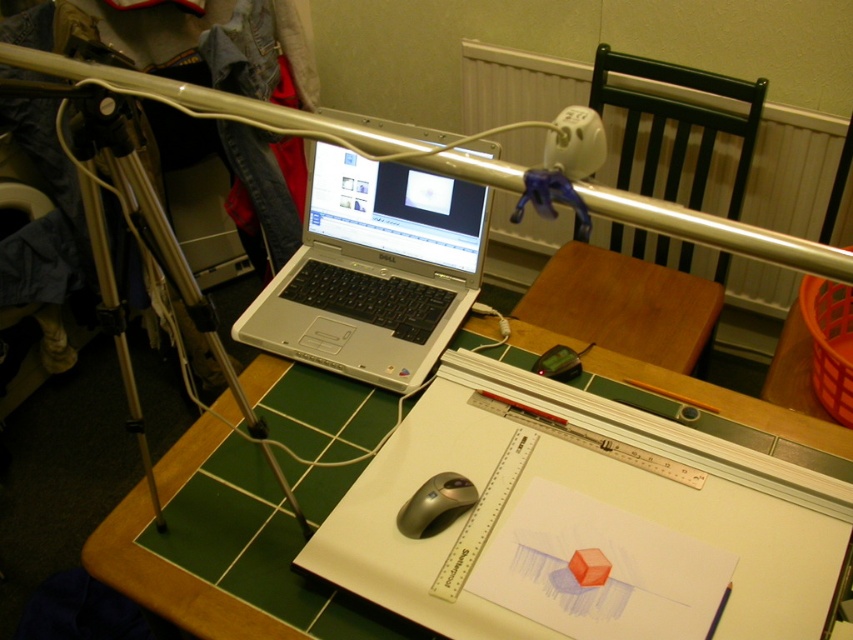
Question: Can you confirm if green tile table at center is positioned below silver metallic rail at upper center?

Choices:
 (A) yes
 (B) no

Answer: (A)

Question: Is silver metallic laptop at center thinner than green tile table at center?

Choices:
 (A) yes
 (B) no

Answer: (B)

Question: Considering the real-world distances, which object is farthest from the silver metallic laptop at center?

Choices:
 (A) silver metallic mouse at center
 (B) green tile table at center
 (C) silver metallic rail at upper center

Answer: (C)

Question: Which of the following is the farthest from the observer?

Choices:
 (A) silver metallic mouse at center
 (B) silver metallic rail at upper center
 (C) green tile table at center

Answer: (A)

Question: Can you confirm if silver metallic rail at upper center is positioned above silver metallic mouse at center?

Choices:
 (A) no
 (B) yes

Answer: (B)

Question: Which point is farther to the camera?

Choices:
 (A) silver metallic laptop at center
 (B) green tile table at center
 (C) silver metallic mouse at center

Answer: (A)